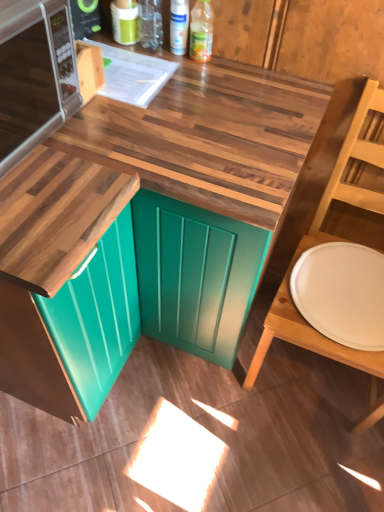
Locate an element on the screen. The height and width of the screenshot is (512, 384). vacant area that is situated to the right of white glossy spray can at upper center, which appears as the first bottle when viewed from the left is located at coordinates (236, 70).